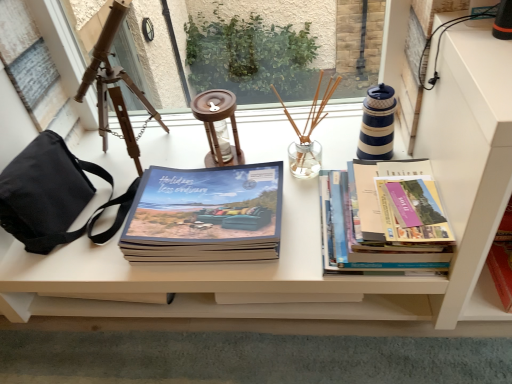
Question: From a real-world perspective, is black canvas bag at left physically above hardcover books at right, which is counted as the 2th book, starting from the right?

Choices:
 (A) no
 (B) yes

Answer: (B)

Question: Can you confirm if black canvas bag at left is taller than hardcover books at right, which is counted as the 2th book, starting from the right?

Choices:
 (A) no
 (B) yes

Answer: (B)

Question: Considering the relative positions of black canvas bag at left and hardcover books at right, which is counted as the 2th book, starting from the right, in the image provided, is black canvas bag at left to the right of hardcover books at right, which is counted as the 2th book, starting from the right, from the viewer's perspective?

Choices:
 (A) yes
 (B) no

Answer: (B)

Question: Would you say black canvas bag at left is outside hardcover books at right, arranged as the 2th book when viewed from the left?

Choices:
 (A) yes
 (B) no

Answer: (A)

Question: Is black canvas bag at left to the left of hardcover books at right, which is counted as the 2th book, starting from the right, from the viewer's perspective?

Choices:
 (A) yes
 (B) no

Answer: (A)

Question: From the image's perspective, is black canvas bag at left under hardcover books at right, which is counted as the 2th book, starting from the right?

Choices:
 (A) no
 (B) yes

Answer: (A)

Question: Does black canvas bag at left lie behind clear glass vase at center, which is the 2th candle holder from right to left?

Choices:
 (A) yes
 (B) no

Answer: (B)

Question: Is black canvas bag at left positioned in front of clear glass vase at center, which is the 2th candle holder from right to left?

Choices:
 (A) yes
 (B) no

Answer: (A)

Question: From the image's perspective, is black canvas bag at left under clear glass vase at center, which is the 2th candle holder from right to left?

Choices:
 (A) yes
 (B) no

Answer: (A)

Question: Is black canvas bag at left facing away from clear glass vase at center, which is the 2th candle holder from right to left?

Choices:
 (A) yes
 (B) no

Answer: (B)

Question: Is there a large distance between black canvas bag at left and clear glass vase at center, which is the 2th candle holder from right to left?

Choices:
 (A) yes
 (B) no

Answer: (B)

Question: From the image's perspective, is black canvas bag at left located above clear glass vase at center, which is the 2th candle holder from right to left?

Choices:
 (A) yes
 (B) no

Answer: (B)

Question: Is matte blue book at center, the first book in the left-to-right sequence, in contact with black canvas bag at left?

Choices:
 (A) no
 (B) yes

Answer: (A)